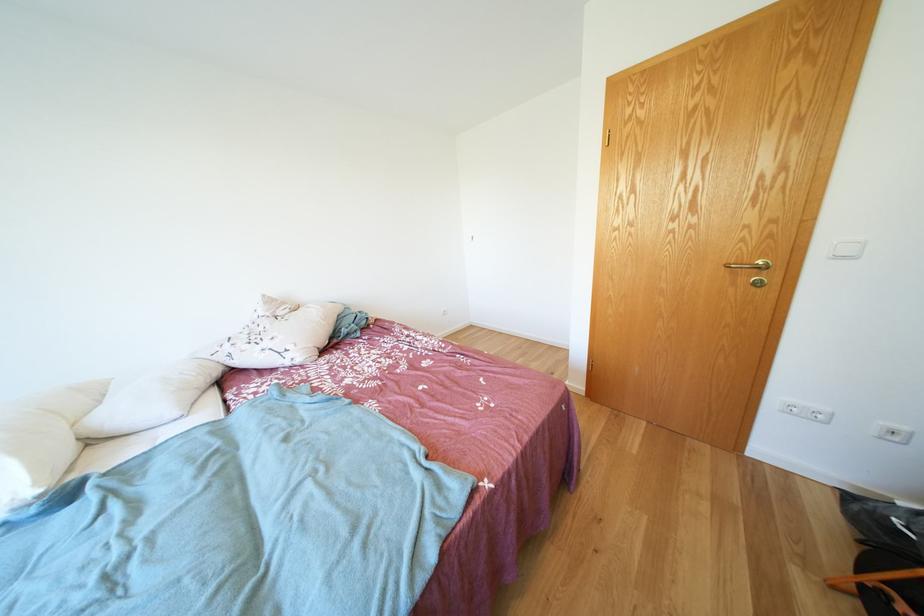
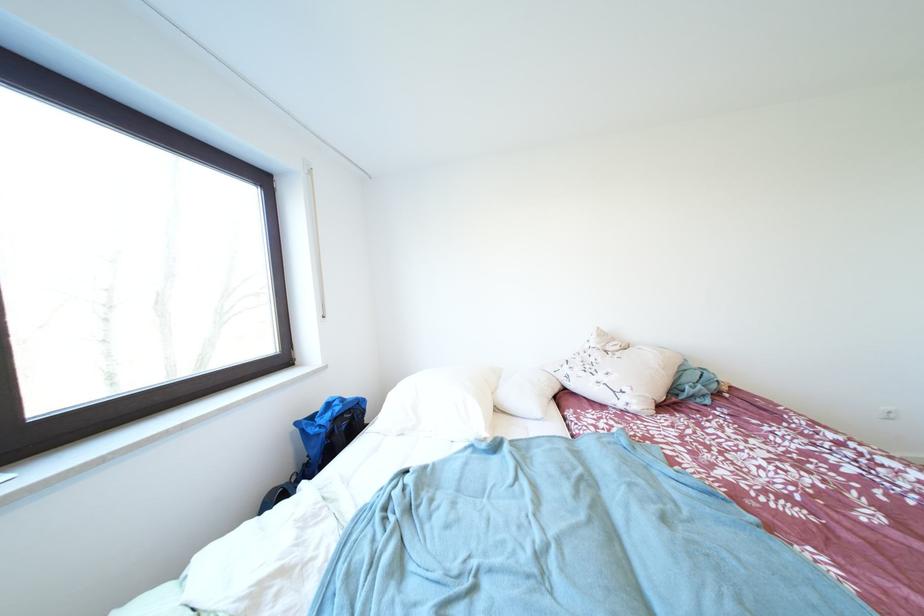
In the second image, find the point that corresponds to pixel 123 422 in the first image.

(517, 403)